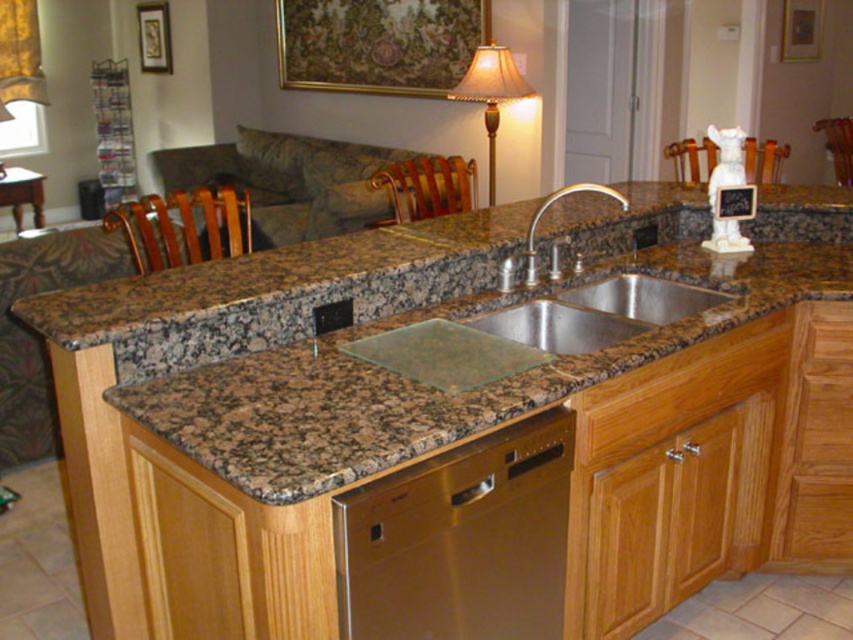
Question: Among these points, which one is farthest from the camera?

Choices:
 (A) (144, 211)
 (B) (347, 572)

Answer: (A)

Question: Is wooden chair at left to the left of gold metallic faucet at center from the viewer's perspective?

Choices:
 (A) yes
 (B) no

Answer: (A)

Question: Which of the following is the closest to the observer?

Choices:
 (A) white ceramic vase at upper right
 (B) stainless steel dishwasher at lower center
 (C) gold metallic faucet at center
 (D) brown wood chair at left

Answer: (B)

Question: In this image, where is gold fabric lampshade at upper center located relative to gold metallic faucet at center?

Choices:
 (A) above
 (B) below

Answer: (A)

Question: Does brown wood chair at left have a greater width compared to white ceramic vase at upper right?

Choices:
 (A) no
 (B) yes

Answer: (B)

Question: Considering the real-world distances, which object is closest to the stainless steel dishwasher at lower center?

Choices:
 (A) wooden drawer at lower center
 (B) brown granite countertop at center
 (C) gold metallic faucet at center

Answer: (B)